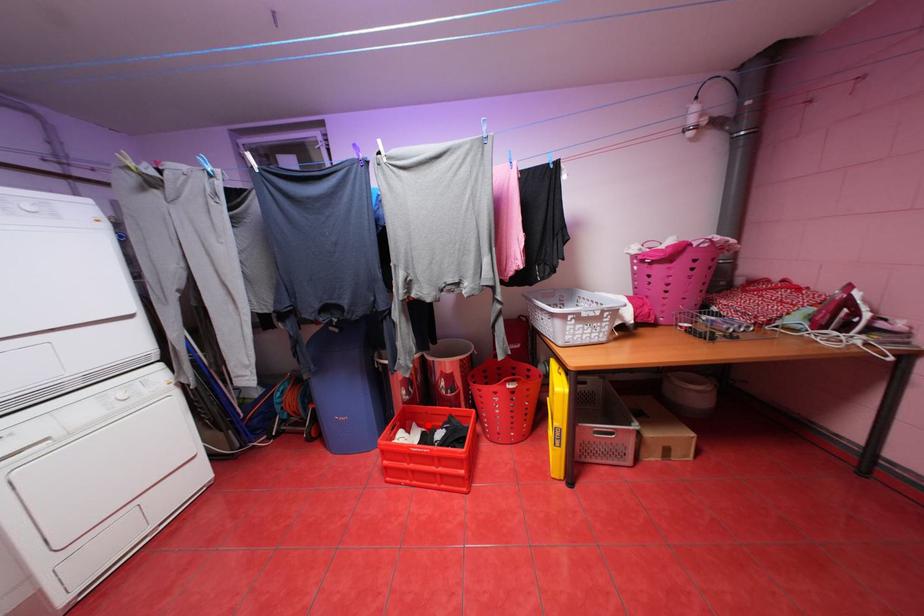
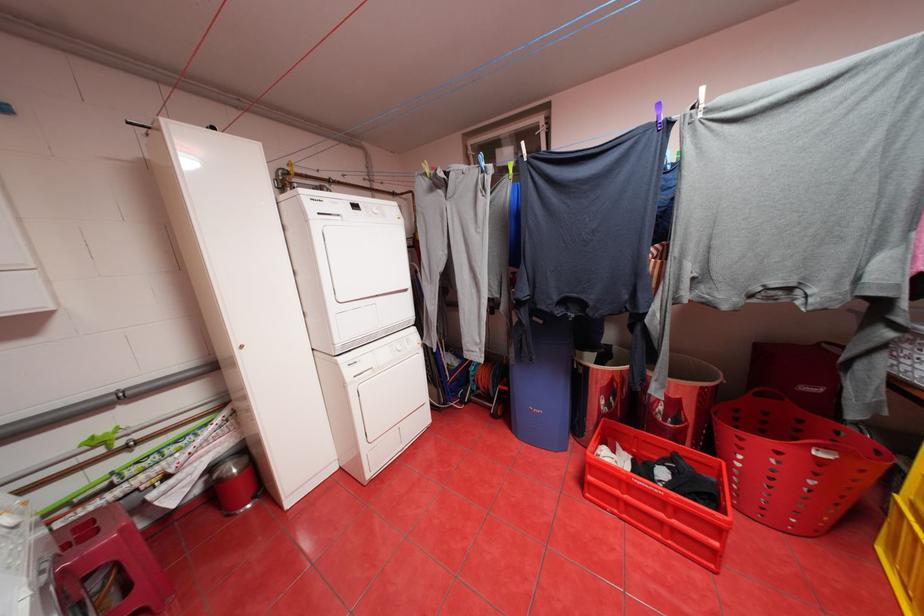
In the second image, find the point that corresponds to the highlighted location in the first image.

(631, 448)